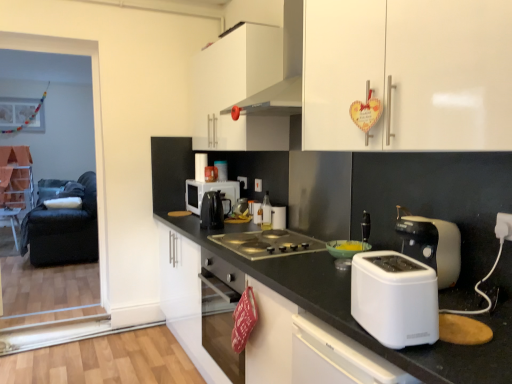
I want to click on free location in front of white plastic toaster at right, the 2th toaster in the front-to-back sequence, so click(x=470, y=305).